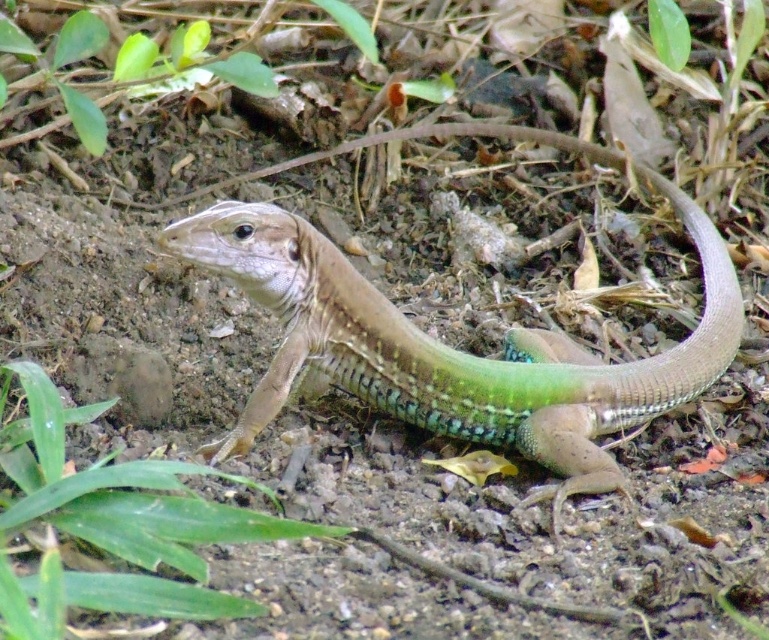
Question: Among these points, which one is nearest to the camera?

Choices:
 (A) (288, 328)
 (B) (192, 577)

Answer: (B)

Question: Which object is closer to the camera taking this photo?

Choices:
 (A) green scaly lizard at center
 (B) green leafy grass at lower left

Answer: (B)

Question: Can you confirm if green scaly lizard at center is bigger than green leafy grass at lower left?

Choices:
 (A) no
 (B) yes

Answer: (B)

Question: Is green scaly lizard at center to the left of green leafy grass at lower left from the viewer's perspective?

Choices:
 (A) no
 (B) yes

Answer: (A)

Question: Which point is closer to the camera?

Choices:
 (A) green leafy grass at lower left
 (B) green scaly lizard at center

Answer: (A)

Question: In this image, where is green scaly lizard at center located relative to green leafy grass at lower left?

Choices:
 (A) above
 (B) below

Answer: (A)